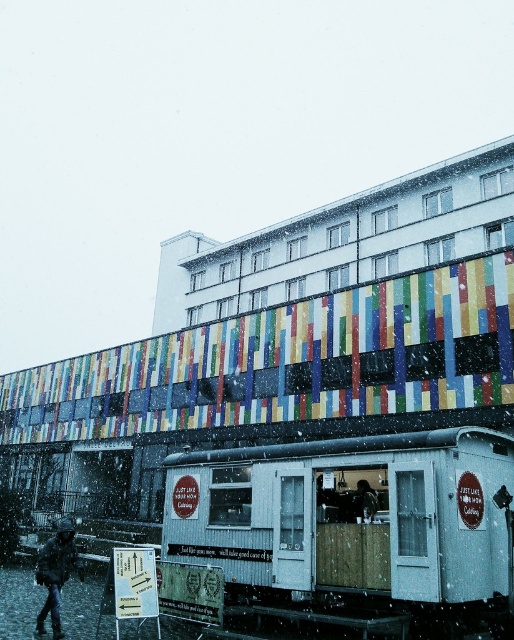
Can you confirm if metallic silver trailer at center is positioned to the left of dark green textured coat at lower left?

Incorrect, metallic silver trailer at center is not on the left side of dark green textured coat at lower left.

What are the coordinates of `metallic silver trailer at center` in the screenshot? It's located at (353, 520).

In the scene shown: Does metallic silver trailer at center appear on the right side of dark blue jacket at center?

In fact, metallic silver trailer at center is to the left of dark blue jacket at center.

You are a GUI agent. You are given a task and a screenshot of the screen. Output one action in this format:
    pyautogui.click(x=<x>, y=<y>)
    Task: Click on the metallic silver trailer at center
    
    Given the screenshot: What is the action you would take?
    pyautogui.click(x=353, y=520)

Locate an element on the screen. This screenshot has height=640, width=514. metallic silver trailer at center is located at coordinates (353, 520).

Can you confirm if dark green textured coat at lower left is shorter than dark blue jacket at center?

No.

Is point (58, 579) farther from camera compared to point (359, 502)?

That is False.

The image size is (514, 640). I want to click on dark green textured coat at lower left, so tap(57, 573).